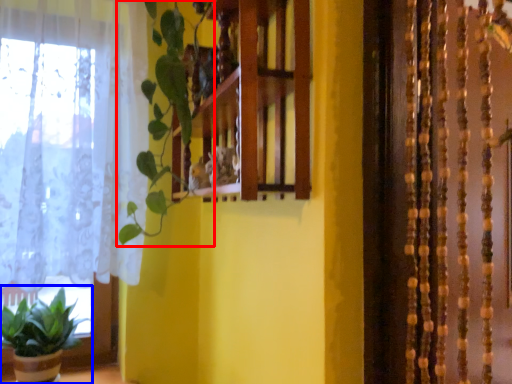
Question: Which of the following is the closest to the observer, vegetation (highlighted by a red box) or houseplant (highlighted by a blue box)?

Choices:
 (A) vegetation
 (B) houseplant

Answer: (A)